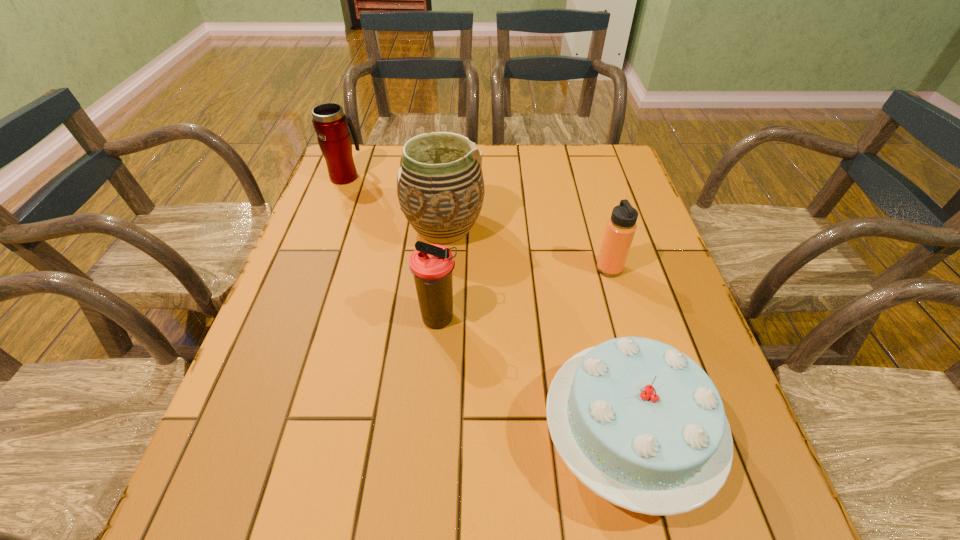
Locate an element on the screen. free area in between the leftmost object and the second farthest object is located at coordinates (395, 201).

This screenshot has width=960, height=540. Identify the location of blank region between the leftmost object and the pottery. (395, 201).

This screenshot has width=960, height=540. Identify the location of empty space between the nearest object and the pottery. (535, 333).

Locate an element on the screen. blank region between the nearest object and the second farthest object is located at coordinates (x=535, y=333).

At what (x,y) coordinates should I click in order to perform the action: click on free space between the nearest object and the nearest thermos bottle. Please return your answer as a coordinate pair (x, y). Looking at the image, I should click on (532, 379).

Image resolution: width=960 pixels, height=540 pixels. I want to click on object that is the third closest to the fourth farthest object, so click(x=621, y=227).

Find the location of a particular element. This screenshot has width=960, height=540. object that can be found as the third closest to the second thermos bottle from left to right is located at coordinates (621, 227).

Locate an element on the screen. This screenshot has height=540, width=960. thermos bottle that is the closest to the leftmost object is located at coordinates (431, 265).

Identify the location of thermos bottle that can be found as the closest to the second nearest object. (621, 227).

Find the location of a particular element. Image resolution: width=960 pixels, height=540 pixels. free space that satisfies the following two spatial constraints: 1. on the front side of the nearest thermos bottle; 2. on the left side of the nearest object is located at coordinates (429, 438).